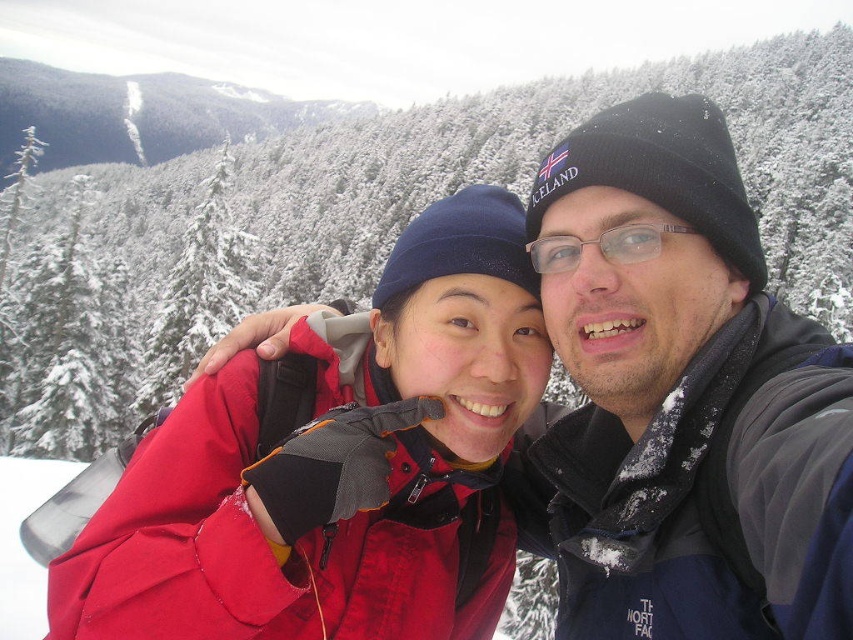
Does matte red jacket at center have a lesser width compared to transparent plastic glasses at center?

Correct, matte red jacket at center's width is less than transparent plastic glasses at center's.

Which is behind, point (490, 572) or point (618, 262)?

Point (490, 572)

This screenshot has width=853, height=640. Describe the element at coordinates (337, 468) in the screenshot. I see `matte red jacket at center` at that location.

I want to click on matte red jacket at center, so click(x=337, y=468).

Measure the distance between black knit hat at upper right and camera.

black knit hat at upper right and camera are 3.91 meters apart.

Can you confirm if black knit hat at upper right is shorter than matte red jacket at center?

No, black knit hat at upper right is not shorter than matte red jacket at center.

Which is behind, point (843, 584) or point (393, 394)?

The point (393, 394) is behind.

Identify the location of black knit hat at upper right. This screenshot has height=640, width=853. point(682,397).

Does black knit hat at upper right appear on the right side of transparent plastic glasses at center?

Yes, black knit hat at upper right is to the right of transparent plastic glasses at center.

How distant is black knit hat at upper right from transparent plastic glasses at center?

They are 47.42 centimeters apart.

Is point (653, 464) closer to viewer compared to point (578, 250)?

Yes, it is in front of point (578, 250).

You are a GUI agent. You are given a task and a screenshot of the screen. Output one action in this format:
    pyautogui.click(x=<x>, y=<y>)
    Task: Click on the black knit hat at upper right
    
    Given the screenshot: What is the action you would take?
    pyautogui.click(x=682, y=397)